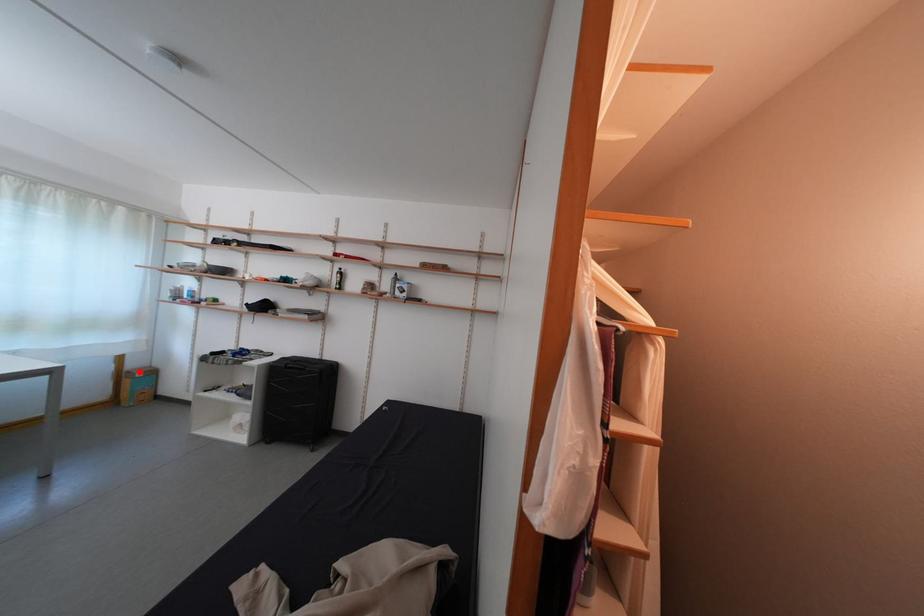
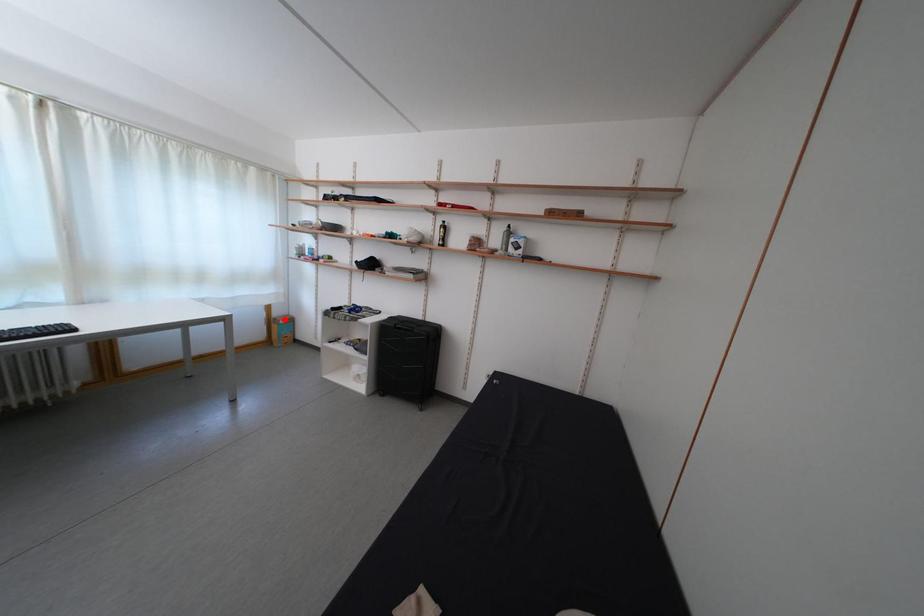
I am providing you with two images of the same scene from different viewpoints. A red point is marked on the first image and another point is marked on the second image. Is the red point in image1 aligned with the point shown in image2?

Yes